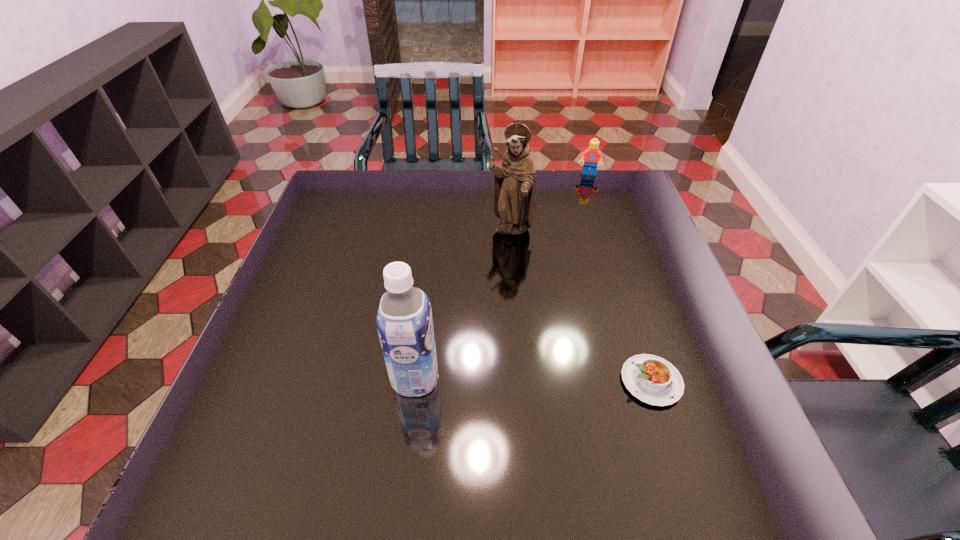
This screenshot has height=540, width=960. Identify the location of the third closest object relative to the leftmost object. (591, 156).

Locate an element on the screen. vacant space that satisfies the following two spatial constraints: 1. on the front side of the second farthest object; 2. on the left side of the shortest object is located at coordinates (522, 381).

In order to click on vacant area that satisfies the following two spatial constraints: 1. on the back side of the second farthest object; 2. on the left side of the second shortest object in this screenshot , I will do `click(506, 174)`.

Where is `free spot that satisfies the following two spatial constraints: 1. on the back side of the third object from right to left; 2. on the right side of the farthest object`? Image resolution: width=960 pixels, height=540 pixels. free spot that satisfies the following two spatial constraints: 1. on the back side of the third object from right to left; 2. on the right side of the farthest object is located at coordinates (506, 174).

This screenshot has width=960, height=540. Identify the location of free space that satisfies the following two spatial constraints: 1. on the back side of the Lego; 2. on the left side of the pudding. (585, 174).

This screenshot has width=960, height=540. I want to click on vacant space that satisfies the following two spatial constraints: 1. on the front side of the pudding; 2. on the right side of the second farthest object, so click(522, 381).